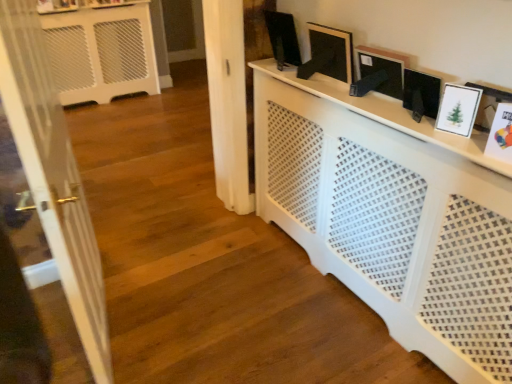
This screenshot has height=384, width=512. I want to click on vacant area on top of white perforated radiator at center (from a real-world perspective), so click(375, 99).